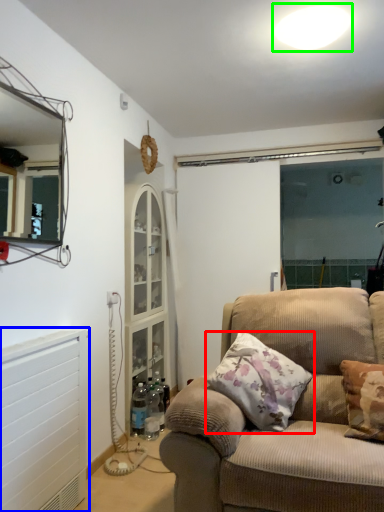
Question: Considering the real-world distances, which object is closest to pillow (highlighted by a red box)? radiator (highlighted by a blue box) or light (highlighted by a green box).

Choices:
 (A) radiator
 (B) light

Answer: (A)